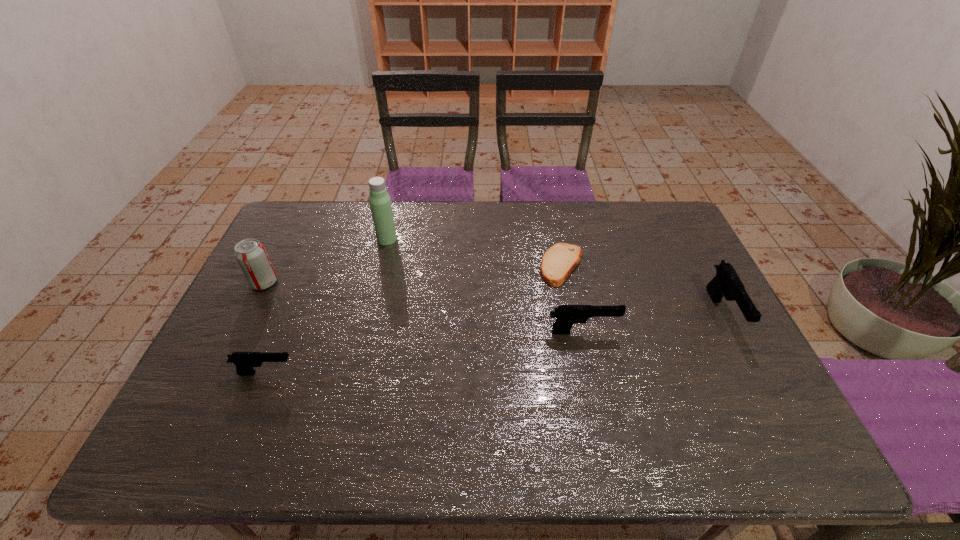
Locate an element on the screen. free spot that satisfies the following two spatial constraints: 1. on the front-facing side of the rightmost object; 2. on the front-facing side of the leftmost pistol is located at coordinates (754, 373).